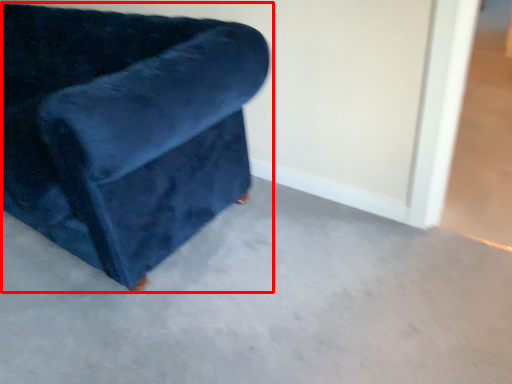
Question: Where is chair (annotated by the red box) located in relation to concrete in the image?

Choices:
 (A) left
 (B) right

Answer: (A)